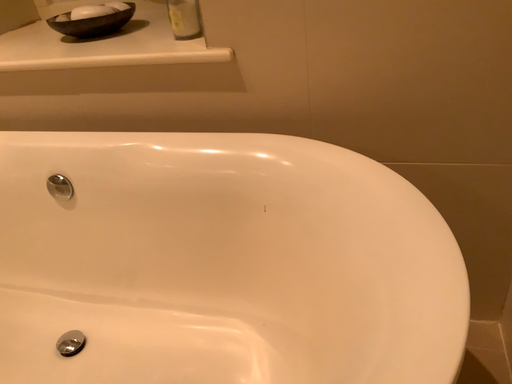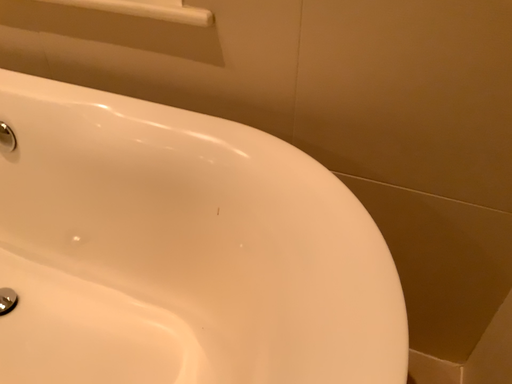
Question: Which way did the camera rotate in the video?

Choices:
 (A) rotated upward
 (B) rotated downward

Answer: (B)